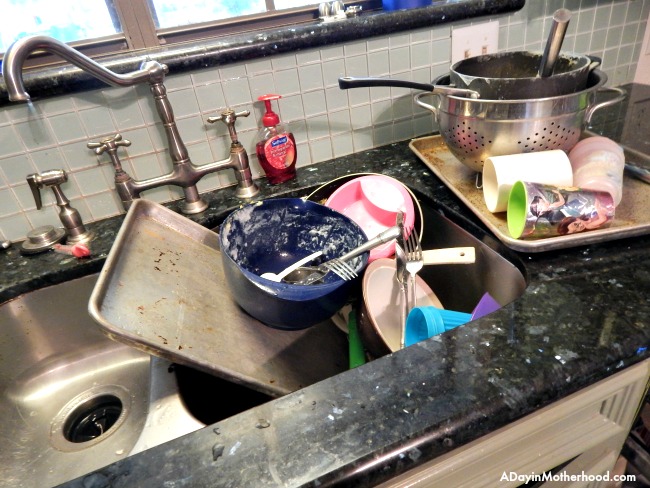
This screenshot has height=488, width=650. I want to click on windows, so click(x=80, y=33), click(x=194, y=10).